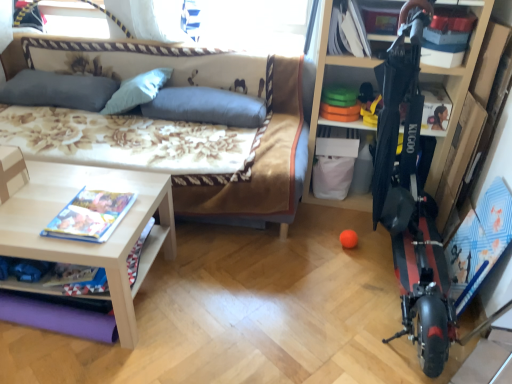
Where is `free location to the left of hardcover book at lower left, the first book in the front-to-back sequence`? free location to the left of hardcover book at lower left, the first book in the front-to-back sequence is located at coordinates (35, 209).